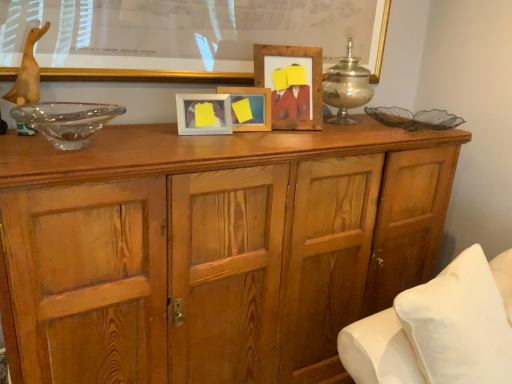
At what (x,y) coordinates should I click in order to perform the action: click on free space in front of wooden picture frame at center, which ranks as the 3th picture frame in left-to-right order. Please return your answer as a coordinate pair (x, y). This screenshot has width=512, height=384. Looking at the image, I should click on (280, 125).